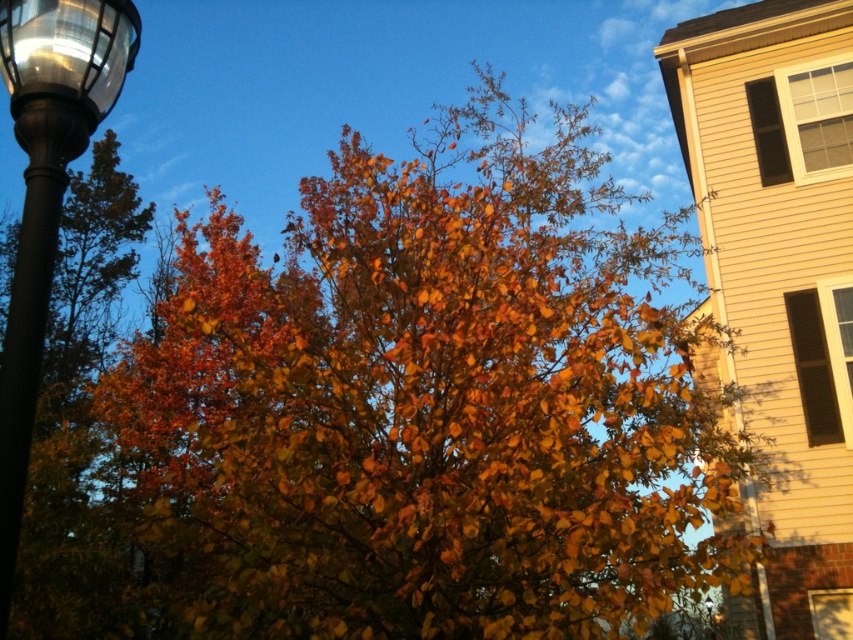
Does autumn leaves at center appear under polished metal street light at left?

Indeed, autumn leaves at center is positioned under polished metal street light at left.

Between autumn leaves at center and polished metal street light at left, which one is positioned higher?

Positioned higher is polished metal street light at left.

At what (x,y) coordinates should I click in order to perform the action: click on autumn leaves at center. Please return your answer as a coordinate pair (x, y). Image resolution: width=853 pixels, height=640 pixels. Looking at the image, I should click on (424, 406).

Which is more to the right, polished metal street light at left or metallic glass streetlight at upper left?

From the viewer's perspective, metallic glass streetlight at upper left appears more on the right side.

Who is more forward, [27,209] or [57,38]?

Point [57,38] is in front.

Locate an element on the screen. The image size is (853, 640). polished metal street light at left is located at coordinates pos(45,195).

Is autumn leaves at center positioned before metallic glass streetlight at upper left?

No.

Between autumn leaves at center and metallic glass streetlight at upper left, which one has less height?

metallic glass streetlight at upper left

The height and width of the screenshot is (640, 853). What do you see at coordinates (424, 406) in the screenshot?
I see `autumn leaves at center` at bounding box center [424, 406].

This screenshot has height=640, width=853. I want to click on autumn leaves at center, so click(x=424, y=406).